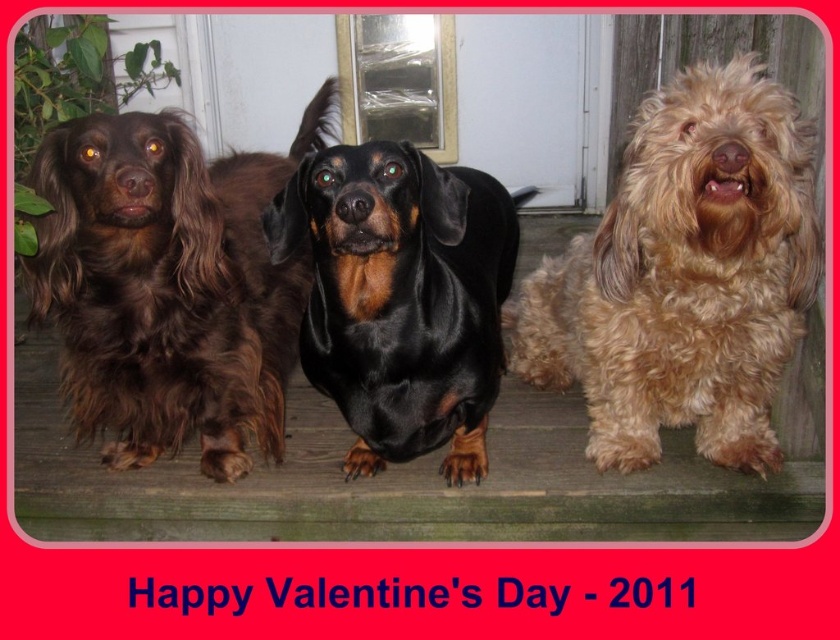
Is fuzzy golden dog at right further to the viewer compared to black shiny coat at center?

Yes, fuzzy golden dog at right is behind black shiny coat at center.

Can you confirm if fuzzy golden dog at right is positioned to the right of black shiny coat at center?

Indeed, fuzzy golden dog at right is positioned on the right side of black shiny coat at center.

Which is behind, point (718, 376) or point (358, 381)?

The point (718, 376) is behind.

You are a GUI agent. You are given a task and a screenshot of the screen. Output one action in this format:
    pyautogui.click(x=<x>, y=<y>)
    Task: Click on the fuzzy golden dog at right
    This screenshot has height=640, width=840.
    Given the screenshot: What is the action you would take?
    pyautogui.click(x=684, y=275)

Based on the photo, can you confirm if shiny brown fur at left is taller than black shiny coat at center?

Correct, shiny brown fur at left is much taller as black shiny coat at center.

Which of these two, shiny brown fur at left or black shiny coat at center, stands shorter?

black shiny coat at center

Between point (291, 298) and point (412, 220), which one is positioned in front?

Point (412, 220) is in front.

Where is `shiny brown fur at left`? shiny brown fur at left is located at coordinates (168, 285).

Who is lower down, fuzzy golden dog at right or shiny brown fur at left?

fuzzy golden dog at right is lower down.

Is fuzzy golden dog at right smaller than shiny brown fur at left?

Indeed, fuzzy golden dog at right has a smaller size compared to shiny brown fur at left.

Measure the distance between fuzzy golden dog at right and camera.

3.94 feet

I want to click on fuzzy golden dog at right, so click(x=684, y=275).